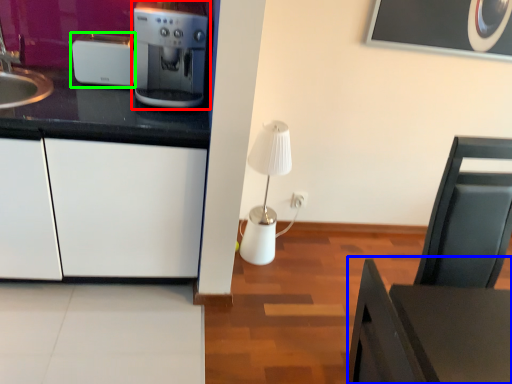
Question: Considering the real-world distances, which object is closest to home appliance (highlighted by a red box)? table (highlighted by a blue box) or kitchen appliance (highlighted by a green box).

Choices:
 (A) table
 (B) kitchen appliance

Answer: (B)